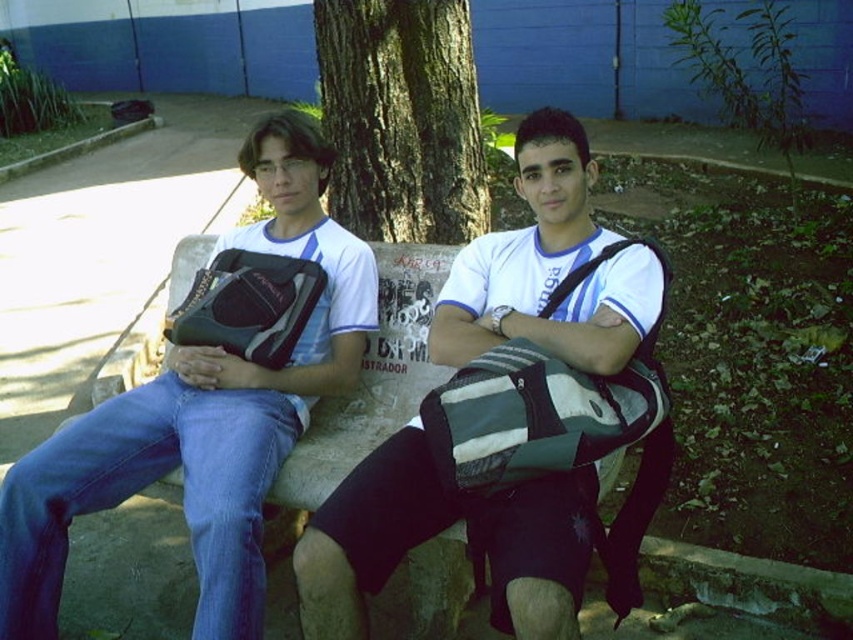
Which is more to the left, matte black backpack at center or matte black bag at left?

matte black bag at left

Measure the distance between matte black backpack at center and matte black bag at left.

A: matte black backpack at center is 21.72 inches from matte black bag at left.

Between point (438, 342) and point (339, 276), which one is positioned behind?

Positioned behind is point (339, 276).

Locate an element on the screen. Image resolution: width=853 pixels, height=640 pixels. matte black backpack at center is located at coordinates (438, 532).

Is matte black backpack at center closer to camera compared to green rough bark tree at center?

Yes, it is in front of green rough bark tree at center.

Which is above, matte black backpack at center or green rough bark tree at center?

green rough bark tree at center is higher up.

Identify the location of matte black backpack at center. (438, 532).

Locate an element on the screen. matte black backpack at center is located at coordinates (438, 532).

In the scene shown: Is matte black bag at left above green rough bark tree at center?

No, matte black bag at left is not above green rough bark tree at center.

Is matte black bag at left further to camera compared to green rough bark tree at center?

No, matte black bag at left is closer to the viewer.

Where is `matte black bag at left`? The height and width of the screenshot is (640, 853). matte black bag at left is located at coordinates (202, 416).

Where is `matte black bag at left`? This screenshot has height=640, width=853. matte black bag at left is located at coordinates pos(202,416).